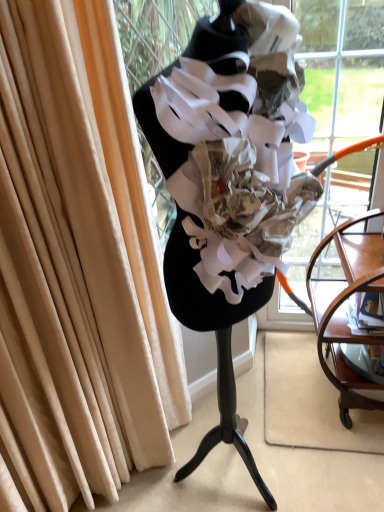
Identify the location of vacant space situated on the left part of mahogany wood side table at right. (285, 387).